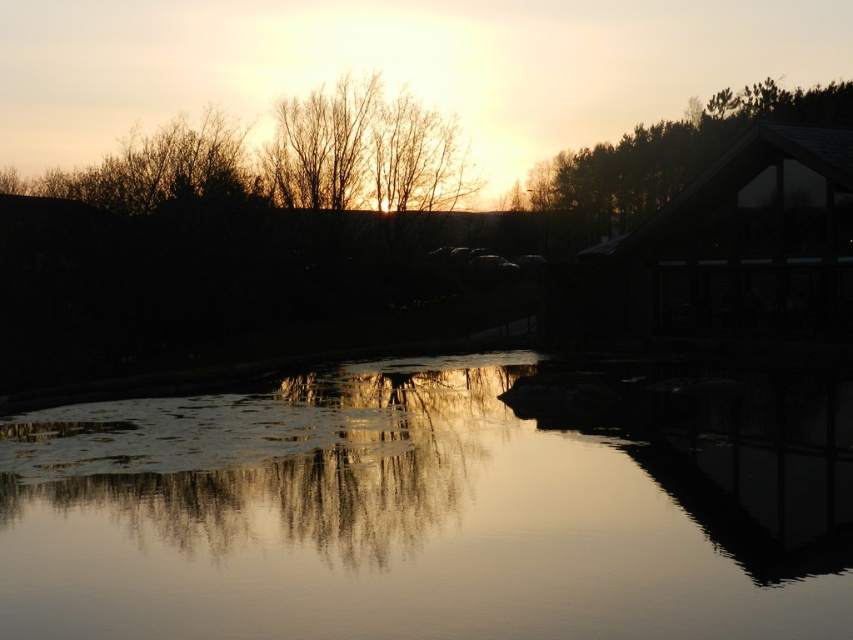
Question: Does silvery reflective water at center appear under green matte roof at upper right?

Choices:
 (A) no
 (B) yes

Answer: (B)

Question: Is silvery reflective water at center bigger than brown wooden hut at upper right?

Choices:
 (A) yes
 (B) no

Answer: (B)

Question: Is silvery reflective water at center above brown wooden hut at upper right?

Choices:
 (A) no
 (B) yes

Answer: (A)

Question: Which object is the closest to the brown wooden hut at upper right?

Choices:
 (A) green matte roof at upper right
 (B) silvery reflective water at center

Answer: (B)

Question: Which object appears farthest from the camera in this image?

Choices:
 (A) brown wooden hut at upper right
 (B) silvery reflective water at center

Answer: (A)

Question: Among these objects, which one is nearest to the camera?

Choices:
 (A) green matte roof at upper right
 (B) silvery reflective water at center

Answer: (B)